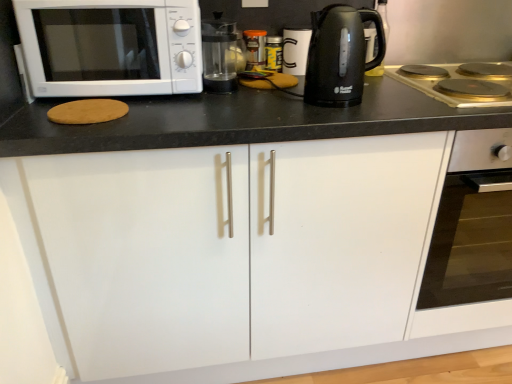
Question: Is gold-coated stovetop at right positioned behind transparent glass coffee machine at center?

Choices:
 (A) yes
 (B) no

Answer: (B)

Question: Is gold-coated stovetop at right placed right next to transparent glass coffee machine at center?

Choices:
 (A) yes
 (B) no

Answer: (B)

Question: Can you confirm if gold-coated stovetop at right is smaller than transparent glass coffee machine at center?

Choices:
 (A) yes
 (B) no

Answer: (B)

Question: Does gold-coated stovetop at right have a lesser width compared to transparent glass coffee machine at center?

Choices:
 (A) no
 (B) yes

Answer: (A)

Question: Is gold-coated stovetop at right oriented away from transparent glass coffee machine at center?

Choices:
 (A) yes
 (B) no

Answer: (B)

Question: Can you confirm if gold-coated stovetop at right is positioned to the left of transparent glass coffee machine at center?

Choices:
 (A) no
 (B) yes

Answer: (A)

Question: Is white matte microwave at left at the left side of white matte cabinet at center?

Choices:
 (A) yes
 (B) no

Answer: (A)

Question: Does white matte microwave at left turn towards white matte cabinet at center?

Choices:
 (A) no
 (B) yes

Answer: (A)

Question: From the image's perspective, is white matte microwave at left beneath white matte cabinet at center?

Choices:
 (A) no
 (B) yes

Answer: (A)

Question: From a real-world perspective, is white matte microwave at left physically below white matte cabinet at center?

Choices:
 (A) no
 (B) yes

Answer: (A)

Question: Is the position of white matte microwave at left less distant than that of white matte cabinet at center?

Choices:
 (A) no
 (B) yes

Answer: (A)

Question: Is white matte microwave at left completely or partially outside of white matte cabinet at center?

Choices:
 (A) no
 (B) yes

Answer: (B)

Question: Is transparent glass coffee machine at center oriented away from gold-coated stovetop at right?

Choices:
 (A) yes
 (B) no

Answer: (B)